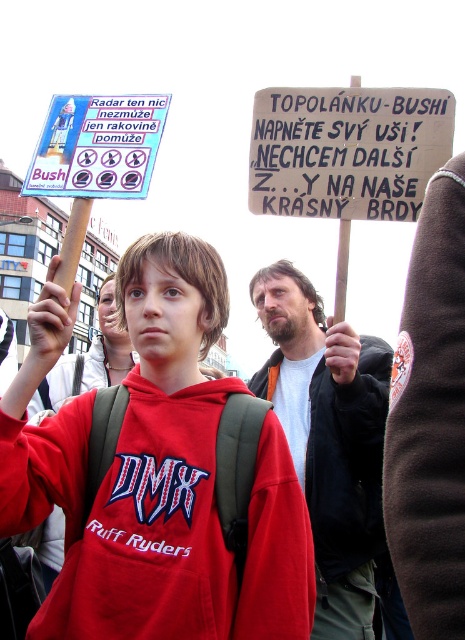
The image size is (465, 640). What do you see at coordinates (98, 147) in the screenshot? I see `matte plastic sign at upper left` at bounding box center [98, 147].

Looking at this image, which is more to the right, matte plastic sign at upper left or matte black jacket at center?

matte plastic sign at upper left

Is point (107, 186) farther from viewer compared to point (117, 365)?

No, (107, 186) is closer to viewer.

The height and width of the screenshot is (640, 465). Identify the location of matte plastic sign at upper left. (98, 147).

Is wooden signboard at upper right to the right of matte black jacket at center from the viewer's perspective?

Correct, you'll find wooden signboard at upper right to the right of matte black jacket at center.

Measure the distance between wooden signboard at upper right and camera.

45.94 meters

I want to click on wooden signboard at upper right, so pyautogui.click(x=346, y=150).

Between wooden signboard at upper right and matte plastic sign at upper left, which one is positioned higher?

matte plastic sign at upper left

Between point (276, 182) and point (85, 152), which one is positioned behind?

Point (85, 152)

Where is `wooden signboard at upper right`? wooden signboard at upper right is located at coordinates (346, 150).